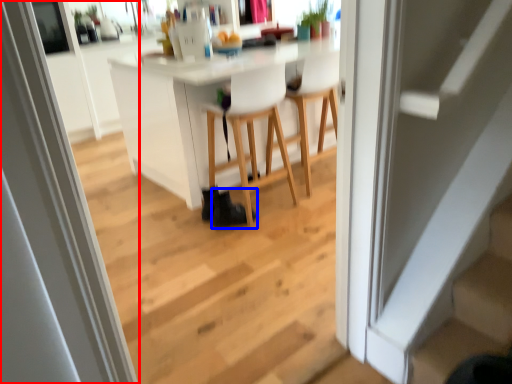
Question: Which of the following is the farthest to the observer, screen door (highlighted by a red box) or shoe (highlighted by a blue box)?

Choices:
 (A) screen door
 (B) shoe

Answer: (B)